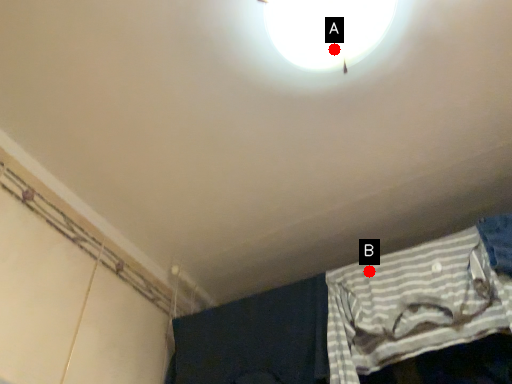
Question: Two points are circled on the image, labeled by A and B beside each circle. Among these points, which one is nearest to the camera?

Choices:
 (A) A is closer
 (B) B is closer

Answer: (A)